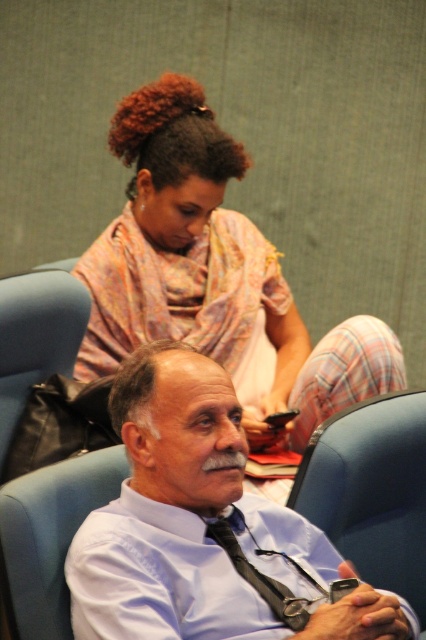
Does point (94, 595) come in front of point (268, 598)?

That is True.

Between point (201, 493) and point (241, 552), which one is positioned in front?

Point (201, 493) is in front.

Does point (109, 552) come in front of point (230, 529)?

Yes, point (109, 552) is closer to viewer.

I want to click on light blue shirt at center, so click(x=206, y=529).

You are a GUI agent. You are given a task and a screenshot of the screen. Output one action in this format:
    pyautogui.click(x=<x>, y=<y>)
    Task: Click on the printed silk blouse at upper center
    This screenshot has height=640, width=426.
    Given the screenshot: What is the action you would take?
    pyautogui.click(x=213, y=275)

Is printed silk blouse at upper center to the right of black satin tie at lower center from the viewer's perspective?

No, printed silk blouse at upper center is not to the right of black satin tie at lower center.

Identify the location of printed silk blouse at upper center. The width and height of the screenshot is (426, 640). [213, 275].

Is light blue shirt at center further to camera compared to printed silk blouse at upper center?

No, it is not.

Does point (126, 451) lie in front of point (282, 403)?

Yes, it is in front of point (282, 403).

Identify the location of light blue shirt at center. (206, 529).